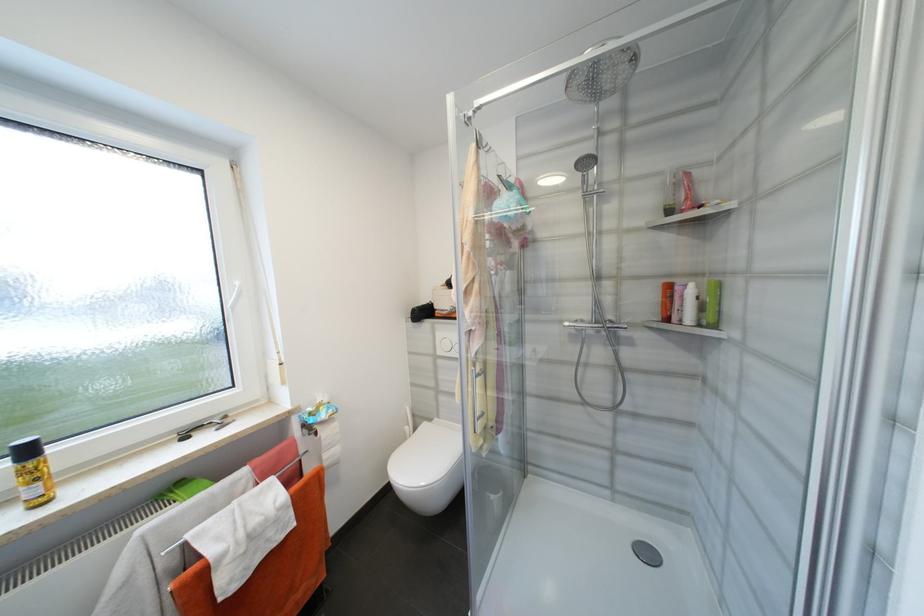
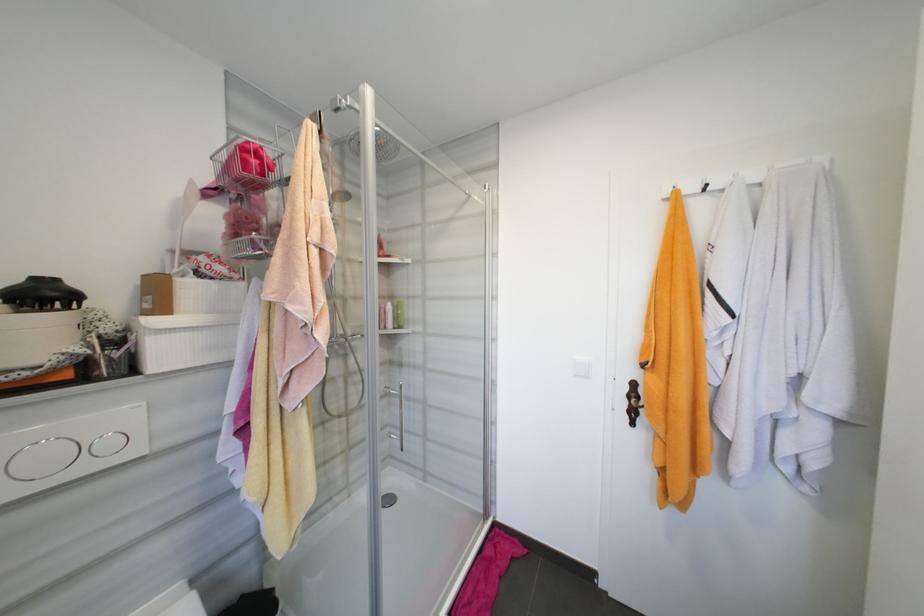
Question: Based on the continuous images, in which direction is the camera rotating? Reply with the corresponding letter.

Choices:
 (A) Left
 (B) Right
 (C) Up
 (D) Down

Answer: (B)